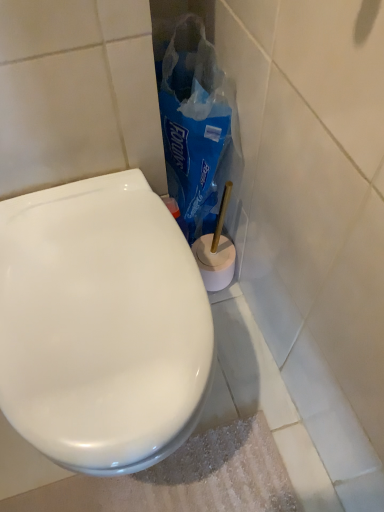
Locate an element on the screen. The height and width of the screenshot is (512, 384). white glossy toilet seat at center is located at coordinates (101, 325).

Measure the distance between point (147,457) and camera.

23.11 inches.

What do you see at coordinates (101, 325) in the screenshot? I see `white glossy toilet seat at center` at bounding box center [101, 325].

Find the location of `blue plastic bag at center`. blue plastic bag at center is located at coordinates (195, 123).

The height and width of the screenshot is (512, 384). What do you see at coordinates (195, 123) in the screenshot? I see `blue plastic bag at center` at bounding box center [195, 123].

You are a GUI agent. You are given a task and a screenshot of the screen. Output one action in this format:
    pyautogui.click(x=<x>, y=<y>)
    Task: Click on the white glossy toilet seat at center
    Image resolution: width=384 pixels, height=512 pixels.
    Given the screenshot: What is the action you would take?
    pyautogui.click(x=101, y=325)

Which object is positioned more to the left, white glossy toilet seat at center or blue plastic bag at center?

white glossy toilet seat at center is more to the left.

In the scene shown: Considering their positions, is white glossy toilet seat at center located in front of or behind blue plastic bag at center?

In the image, white glossy toilet seat at center appears in front of blue plastic bag at center.

Is point (35, 419) closer to viewer compared to point (205, 170)?

Yes.

From the image's perspective, does white glossy toilet seat at center appear lower than blue plastic bag at center?

Yes, from the image's perspective, white glossy toilet seat at center is below blue plastic bag at center.

From a real-world perspective, is white glossy toilet seat at center located higher than blue plastic bag at center?

No.

Between white glossy toilet seat at center and blue plastic bag at center, which one has larger width?

white glossy toilet seat at center is wider.

Considering the sizes of objects white glossy toilet seat at center and blue plastic bag at center in the image provided, who is taller, white glossy toilet seat at center or blue plastic bag at center?

Standing taller between the two is blue plastic bag at center.

Looking at the image, does white glossy toilet seat at center seem bigger or smaller compared to blue plastic bag at center?

Considering their sizes, white glossy toilet seat at center takes up more space than blue plastic bag at center.

Choose the correct answer: Is white glossy toilet seat at center inside blue plastic bag at center or outside it?

white glossy toilet seat at center cannot be found inside blue plastic bag at center.

Is white glossy toilet seat at center far from blue plastic bag at center?

No, there isn't a large distance between white glossy toilet seat at center and blue plastic bag at center.

From the picture: Is white glossy toilet seat at center facing away from blue plastic bag at center?

No, blue plastic bag at center is not at the back of white glossy toilet seat at center.

How many degrees apart are the facing directions of white glossy toilet seat at center and blue plastic bag at center?

The angular difference between white glossy toilet seat at center and blue plastic bag at center is 0.000606 degrees.

Measure the distance between white glossy toilet seat at center and blue plastic bag at center.

white glossy toilet seat at center and blue plastic bag at center are 12.38 inches apart from each other.

You are a GUI agent. You are given a task and a screenshot of the screen. Output one action in this format:
    pyautogui.click(x=<x>, y=<y>)
    Task: Click on the paper bag that appears behind the white glossy toilet seat at center
    This screenshot has height=512, width=384.
    Given the screenshot: What is the action you would take?
    pyautogui.click(x=195, y=123)

Does blue plastic bag at center appear on the left side of white glossy toilet seat at center?

In fact, blue plastic bag at center is to the right of white glossy toilet seat at center.

Does blue plastic bag at center lie behind white glossy toilet seat at center?

Yes, it is behind white glossy toilet seat at center.

Which is less distant, (154,49) or (21,222)?

Point (21,222)

From the image's perspective, relative to white glossy toilet seat at center, is blue plastic bag at center above or below?

Based on their image positions, blue plastic bag at center is located above white glossy toilet seat at center.

Looking at this image, from a real-world perspective, relative to white glossy toilet seat at center, is blue plastic bag at center vertically above or below?

blue plastic bag at center is situated higher than white glossy toilet seat at center in the real world.

Considering the relative sizes of blue plastic bag at center and white glossy toilet seat at center in the image provided, is blue plastic bag at center wider than white glossy toilet seat at center?

No.

Is blue plastic bag at center shorter than white glossy toilet seat at center?

No.

Which of these two, blue plastic bag at center or white glossy toilet seat at center, is smaller?

blue plastic bag at center.

Choose the correct answer: Is blue plastic bag at center inside white glossy toilet seat at center or outside it?

blue plastic bag at center is spatially situated outside white glossy toilet seat at center.

From the picture: Is blue plastic bag at center in contact with white glossy toilet seat at center?

No, blue plastic bag at center is not next to white glossy toilet seat at center.

Is blue plastic bag at center looking in the opposite direction of white glossy toilet seat at center?

blue plastic bag at center is not turned away from white glossy toilet seat at center.

What's the angular difference between blue plastic bag at center and white glossy toilet seat at center's facing directions?

blue plastic bag at center and white glossy toilet seat at center are facing 0.000606 degrees away from each other.

How distant is blue plastic bag at center from white glossy toilet seat at center?

blue plastic bag at center is 12.38 inches from white glossy toilet seat at center.

I want to click on paper bag positioned vertically above the white glossy toilet seat at center (from a real-world perspective), so click(x=195, y=123).

What are the coordinates of `paper bag above the white glossy toilet seat at center (from a real-world perspective)` in the screenshot? It's located at (195, 123).

This screenshot has height=512, width=384. I want to click on paper bag on the right side of white glossy toilet seat at center, so click(195, 123).